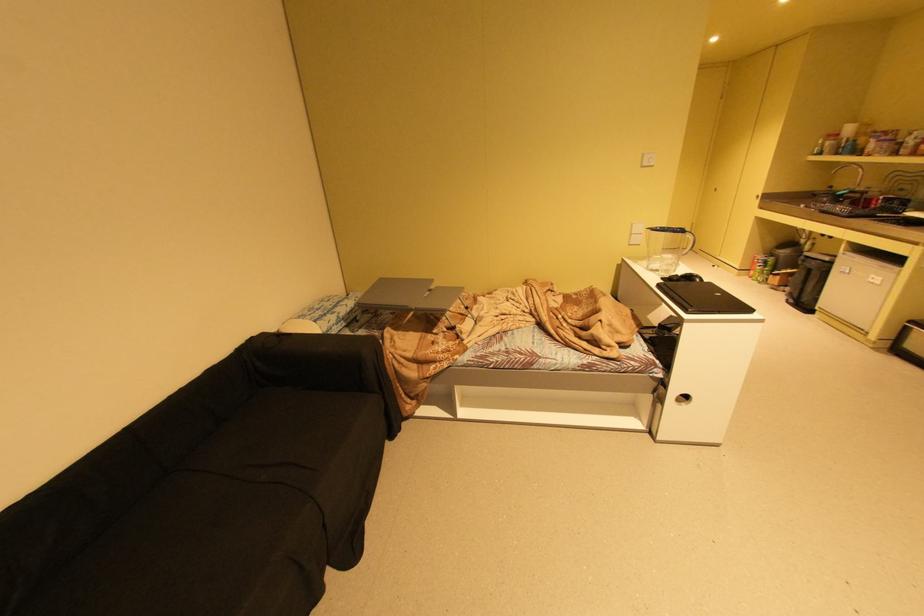
The location [702,299] corresponds to which object?

It corresponds to the black closed laptop in the image.